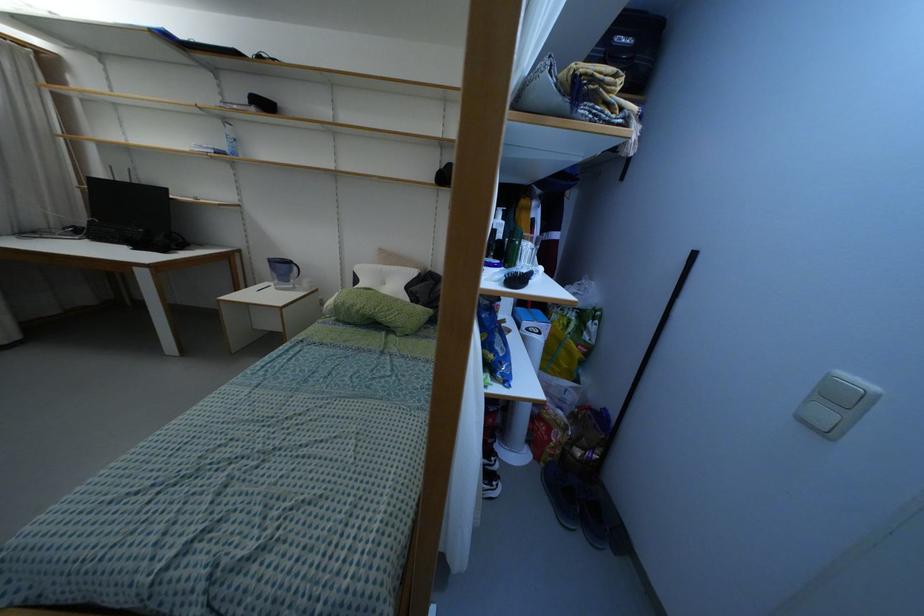
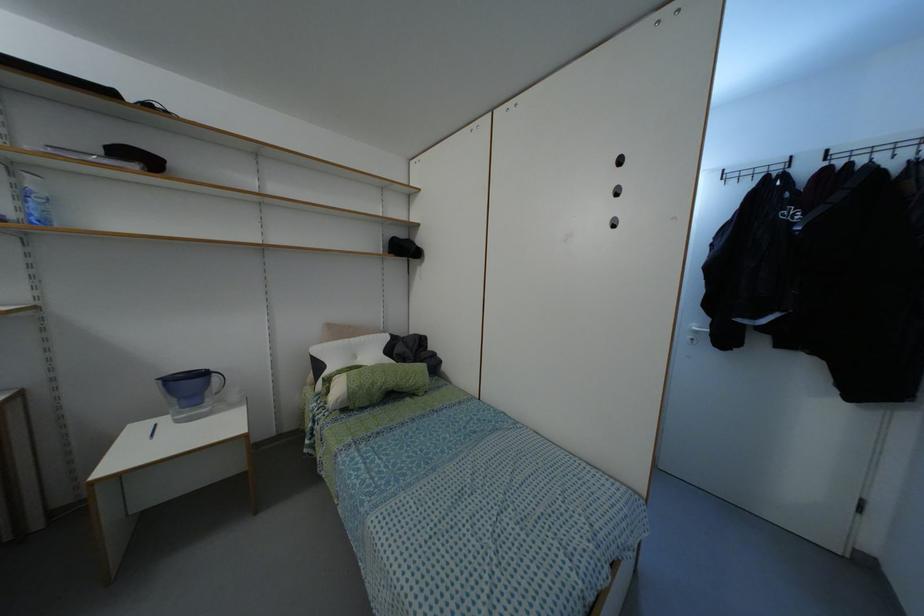
Find the pixel in the second image that matches (351,305) in the first image.

(371, 384)